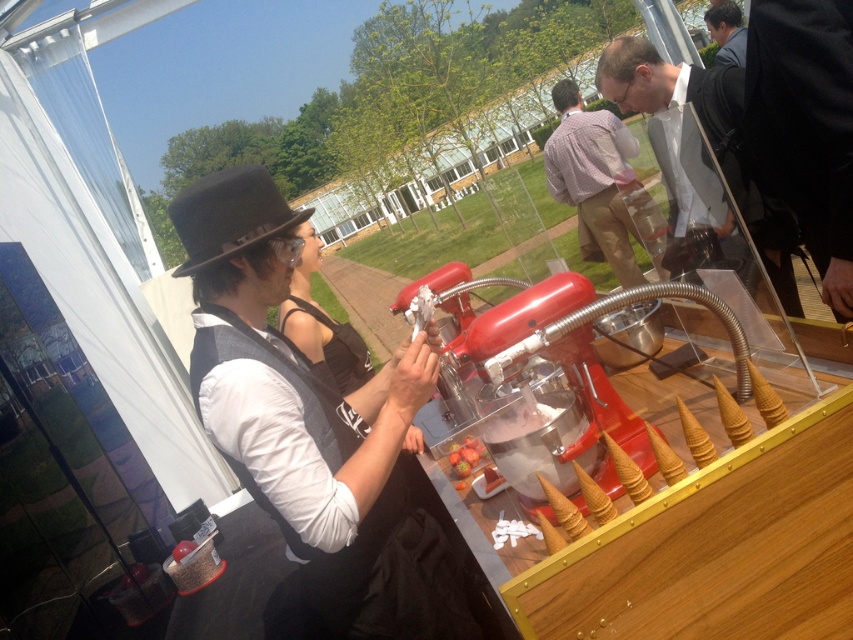
You are a photographer at the event and need to capture a photo of both the black satin dress at center and the smooth black suit at upper right. Considering their sizes, which one should you focus on first to ensure both fit in the frame?

The black satin dress at center has a smaller size compared to the smooth black suit at upper right, so you should focus on the smooth black suit at upper right first to ensure both fit in the frame.

You are at an outdoor event and see the matte black jacket at upper right and the smooth strawberry at center. Which object is taller?

The matte black jacket at upper right is much taller than the smooth strawberry at center.